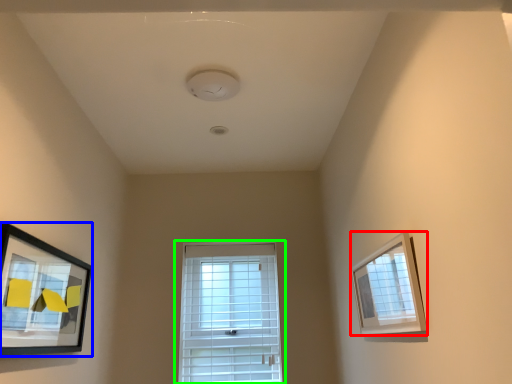
Question: Based on their relative distances, which object is farther from picture frame (highlighted by a red box)? Choose from picture frame (highlighted by a blue box) and window (highlighted by a green box).

Choices:
 (A) picture frame
 (B) window

Answer: (B)